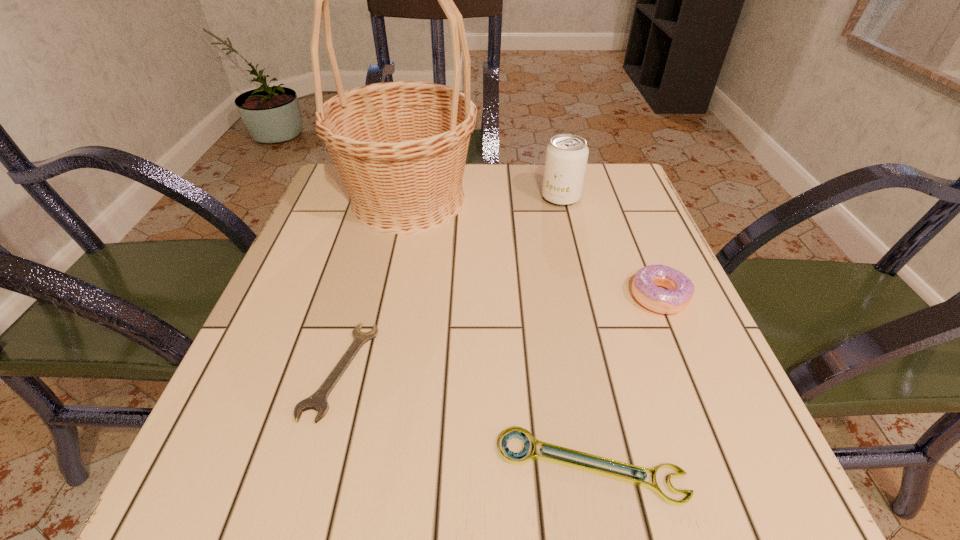
Where is `wrench located at the right edge`? This screenshot has height=540, width=960. wrench located at the right edge is located at coordinates (513, 432).

Locate an element on the screen. This screenshot has width=960, height=540. object that is at the far left corner is located at coordinates click(x=400, y=147).

Identify the location of object present at the far right corner. (566, 157).

Locate an element on the screen. This screenshot has height=540, width=960. object that is at the near right corner is located at coordinates (513, 432).

Locate an element on the screen. The height and width of the screenshot is (540, 960). vacant space at the near edge is located at coordinates (561, 500).

At what (x,y) coordinates should I click in order to perform the action: click on free region at the left edge of the desktop. Please return your answer as a coordinate pair (x, y). Looking at the image, I should click on (324, 228).

Find the location of a particular element. This screenshot has width=960, height=540. vacant space at the right edge of the desktop is located at coordinates (654, 357).

This screenshot has height=540, width=960. Identify the location of free space at the far left corner. (342, 179).

The width and height of the screenshot is (960, 540). Identify the location of vacant region at the far right corner of the desktop. (588, 195).

Where is `empty space that is in between the left wrench and the third farthest object`? The image size is (960, 540). empty space that is in between the left wrench and the third farthest object is located at coordinates (500, 333).